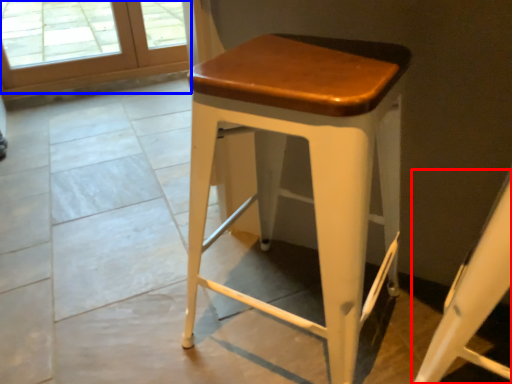
Question: Which object appears closest to the camera in this image, swivel chair (highlighted by a red box) or screen door (highlighted by a blue box)?

Choices:
 (A) swivel chair
 (B) screen door

Answer: (A)